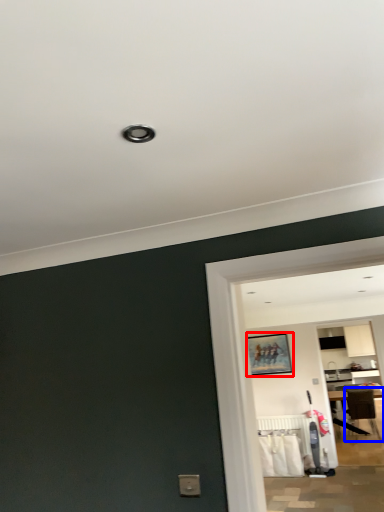
Question: Which point is further to the camera, picture frame (highlighted by a red box) or chair (highlighted by a blue box)?

Choices:
 (A) picture frame
 (B) chair

Answer: (B)